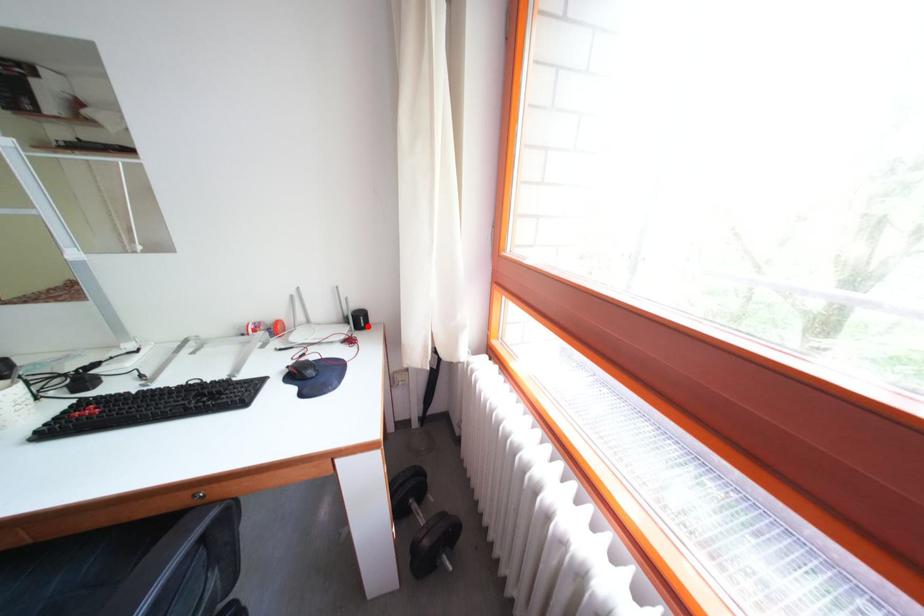
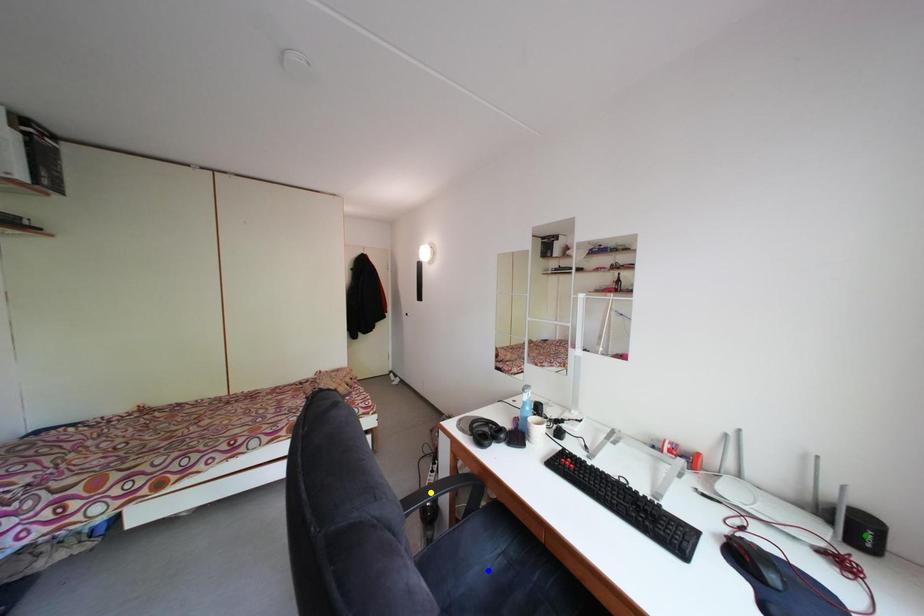
Question: I am providing you with two images of the same scene from different viewpoints. A red point is marked on the first image. You are given multiple points on the second image. Can you choose the point in image 2 that corresponds to the point in image 1?

Choices:
 (A) yellow point
 (B) green point
 (C) blue point

Answer: (B)